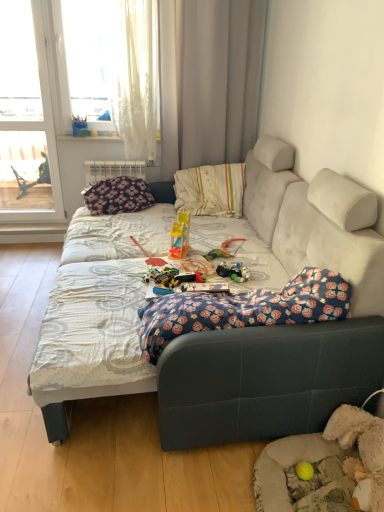
At what (x,y) coordinates should I click in order to perform the action: click on free space in front of yellow rubber ball at lower right, which is the 1th toy from bottom to top. Please return your answer as a coordinate pair (x, y). This screenshot has width=384, height=512. Looking at the image, I should click on click(x=312, y=497).